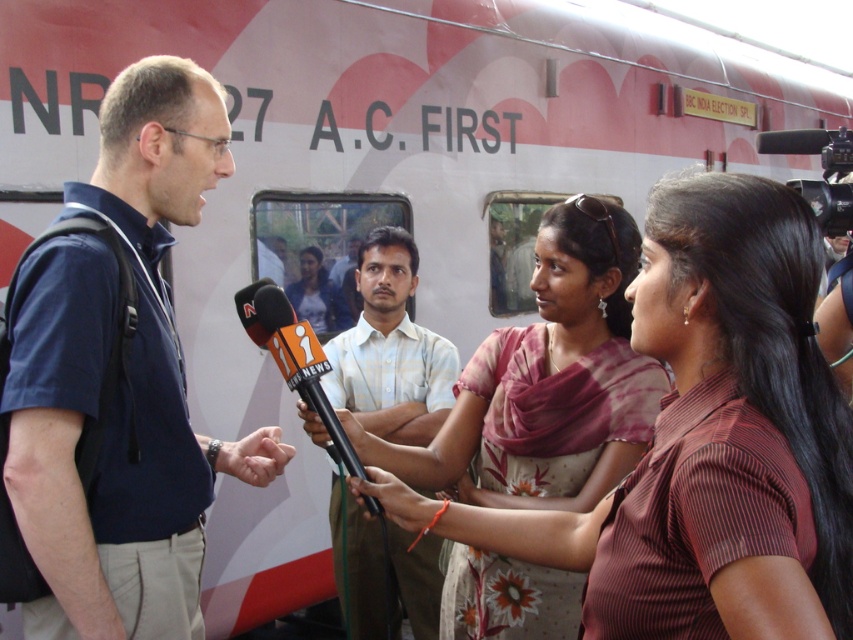
Question: Which object is the closest to the light pink fabric saree at center?

Choices:
 (A) black plastic video camera at upper right
 (B) blue fabric shirt at left
 (C) light blue shirt at center
 (D) black plastic microphone at center

Answer: (D)

Question: Is the position of blue fabric shirt at left less distant than that of black plastic microphone at center?

Choices:
 (A) no
 (B) yes

Answer: (B)

Question: Considering the relative positions of light pink fabric saree at center and black plastic video camera at upper right in the image provided, where is light pink fabric saree at center located with respect to black plastic video camera at upper right?

Choices:
 (A) below
 (B) above

Answer: (A)

Question: Estimate the real-world distances between objects in this image. Which object is farther from the light pink fabric saree at center?

Choices:
 (A) light blue shirt at center
 (B) blue fabric shirt at left

Answer: (A)

Question: Among these points, which one is farthest from the camera?

Choices:
 (A) (154, 90)
 (B) (309, 348)
 (C) (396, 289)

Answer: (C)

Question: Is light blue shirt at center above black plastic microphone at center?

Choices:
 (A) yes
 (B) no

Answer: (A)